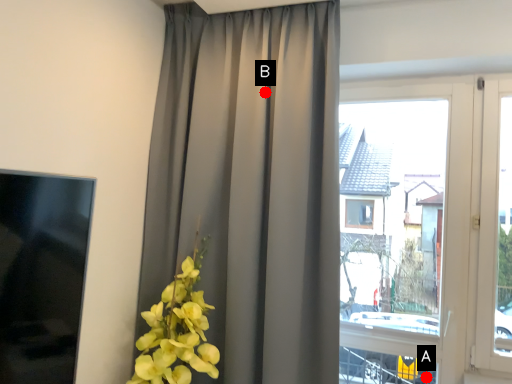
Question: Two points are circled on the image, labeled by A and B beside each circle. Among these points, which one is nearest to the camera?

Choices:
 (A) A is closer
 (B) B is closer

Answer: (B)